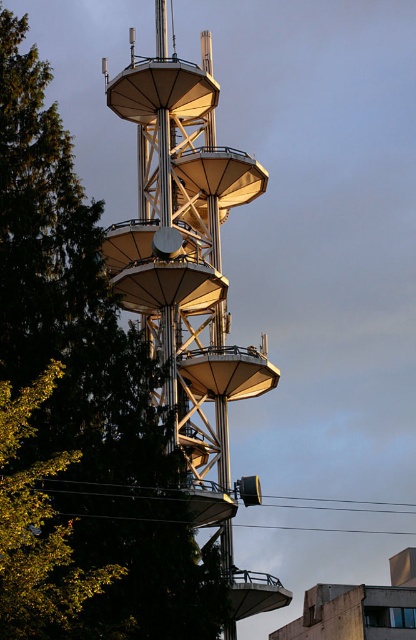
Is green leafy tree at left wider than metallic silver tower at center?

Indeed, green leafy tree at left has a greater width compared to metallic silver tower at center.

Does point (27, 193) lie in front of point (116, 244)?

Yes.

This screenshot has width=416, height=640. What are the coordinates of `green leafy tree at left` in the screenshot? It's located at point(89,376).